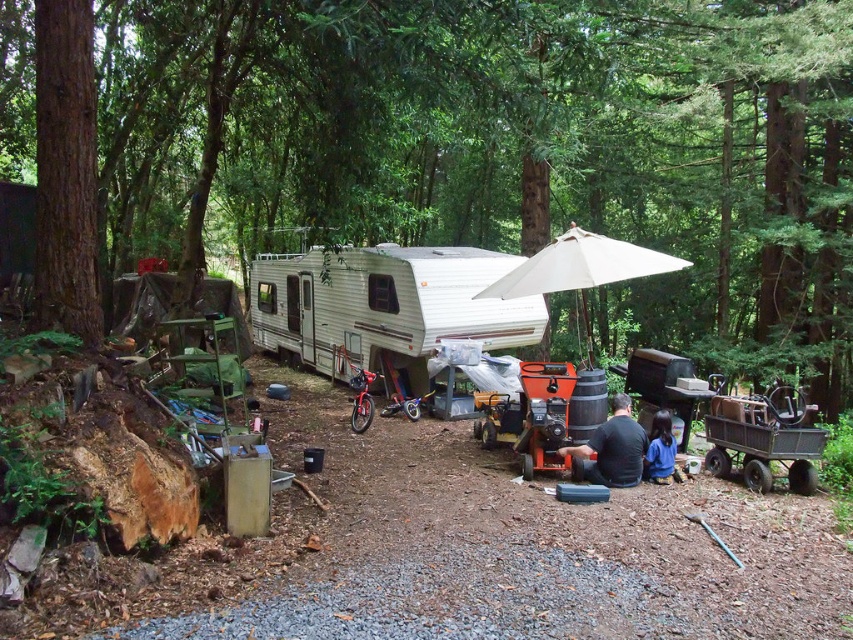
You are a hiker who wants to set up a sunshade. You have a white fabric umbrella at center and a blue fabric jacket at lower right. Which object can provide more vertical coverage for shade?

The white fabric umbrella at center has a greater height compared to the blue fabric jacket at lower right, so it can provide more vertical coverage for shade.

You are standing at the gravel path leading to the white trailer in the camping scene. You see two points marked in the image. Which point is closer to you, point (x=440, y=298) or point (x=662, y=438)?

Point (x=440, y=298) is closer to you because it is further to the viewer than point (x=662, y=438).